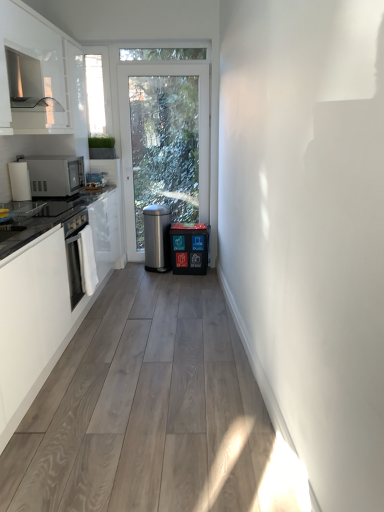
I want to click on vacant space in front of metallic silver dishwasher at center, so click(x=186, y=275).